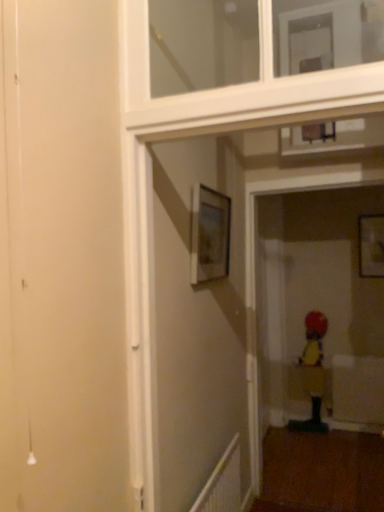
Describe the element at coordinates (209, 234) in the screenshot. I see `matte wooden picture frame at upper center, which ranks as the 1th picture frame in left-to-right order` at that location.

The image size is (384, 512). What are the coordinates of `matte wooden picture frame at upper right, placed as the 1th picture frame when sorted from right to left` in the screenshot? It's located at (371, 246).

In order to click on yellow fabric child at lower right in this screenshot , I will do `click(313, 372)`.

Describe the element at coordinates (222, 483) in the screenshot. The width and height of the screenshot is (384, 512). I see `white plastic radiator at lower right` at that location.

The image size is (384, 512). I want to click on white plastic radiator at lower right, so click(x=222, y=483).

Image resolution: width=384 pixels, height=512 pixels. In order to click on white glossy window frame at upper center in this screenshot , I will do `click(235, 89)`.

Image resolution: width=384 pixels, height=512 pixels. What are the coordinates of `matte wooden picture frame at upper center, which ranks as the 1th picture frame in left-to-right order` in the screenshot? It's located at (209, 234).

Consider the image. Which is less distant, (371, 258) or (237, 93)?

The point (237, 93) is closer to the camera.

Locate an element on the screen. This screenshot has height=512, width=384. picture frame on the right of white glossy window frame at upper center is located at coordinates (371, 246).

From a real-world perspective, who is located lower, matte wooden picture frame at upper right, the first picture frame from the back, or white glossy window frame at upper center?

From a 3D spatial view, matte wooden picture frame at upper right, the first picture frame from the back, is below.

Considering the sizes of matte wooden picture frame at upper right, the 2th picture frame in the left-to-right sequence, and matte wooden picture frame at upper center, which is the first picture frame in front-to-back order, in the image, is matte wooden picture frame at upper right, the 2th picture frame in the left-to-right sequence, taller or shorter than matte wooden picture frame at upper center, which is the first picture frame in front-to-back order,?

Clearly, matte wooden picture frame at upper right, the 2th picture frame in the left-to-right sequence, is taller compared to matte wooden picture frame at upper center, which is the first picture frame in front-to-back order.

Is point (362, 260) farther from viewer compared to point (217, 231)?

Yes.

From a real-world perspective, is matte wooden picture frame at upper right, the 2th picture frame in the left-to-right sequence, on matte wooden picture frame at upper center, which ranks as the 1th picture frame in left-to-right order?

No.

Would you say matte wooden picture frame at upper right, the 2th picture frame in the left-to-right sequence, contains matte wooden picture frame at upper center, the 2th picture frame when ordered from back to front?

Definitely not — matte wooden picture frame at upper center, the 2th picture frame when ordered from back to front, is not inside matte wooden picture frame at upper right, the 2th picture frame in the left-to-right sequence.

From a real-world perspective, which is physically above, matte wooden picture frame at upper center, which is the first picture frame in front-to-back order, or matte wooden picture frame at upper right, which is the 2th picture frame from front to back?

In real-world perspective, matte wooden picture frame at upper center, which is the first picture frame in front-to-back order, is above.

Is matte wooden picture frame at upper center, the 2th picture frame when ordered from back to front, with matte wooden picture frame at upper right, the 2th picture frame in the left-to-right sequence?

matte wooden picture frame at upper center, the 2th picture frame when ordered from back to front, and matte wooden picture frame at upper right, the 2th picture frame in the left-to-right sequence, are not in contact.

Considering the sizes of objects matte wooden picture frame at upper center, which ranks as the 1th picture frame in left-to-right order, and matte wooden picture frame at upper right, the first picture frame from the back, in the image provided, who is wider, matte wooden picture frame at upper center, which ranks as the 1th picture frame in left-to-right order, or matte wooden picture frame at upper right, the first picture frame from the back,?

matte wooden picture frame at upper center, which ranks as the 1th picture frame in left-to-right order, is wider.

Is matte wooden picture frame at upper center, which ranks as the 1th picture frame in left-to-right order, facing towards matte wooden picture frame at upper right, the first picture frame from the back?

No, matte wooden picture frame at upper center, which ranks as the 1th picture frame in left-to-right order, is not oriented towards matte wooden picture frame at upper right, the first picture frame from the back.

From the image's perspective, between yellow fabric child at lower right and matte wooden picture frame at upper center, the 2th picture frame when ordered from right to left, who is located below?

yellow fabric child at lower right is shown below in the image.

From a real-world perspective, relative to matte wooden picture frame at upper center, the 2th picture frame when ordered from back to front, is yellow fabric child at lower right vertically above or below?

yellow fabric child at lower right is situated lower than matte wooden picture frame at upper center, the 2th picture frame when ordered from back to front, in the real world.

Considering the positions of objects yellow fabric child at lower right and matte wooden picture frame at upper center, the 2th picture frame when ordered from back to front, in the image provided, who is behind, yellow fabric child at lower right or matte wooden picture frame at upper center, the 2th picture frame when ordered from back to front,?

Positioned behind is yellow fabric child at lower right.

In the scene shown: Which object is thinner, yellow fabric child at lower right or matte wooden picture frame at upper center, which ranks as the 1th picture frame in left-to-right order?

matte wooden picture frame at upper center, which ranks as the 1th picture frame in left-to-right order.

From the image's perspective, which one is positioned higher, yellow fabric child at lower right or matte wooden picture frame at upper right, the first picture frame from the back?

matte wooden picture frame at upper right, the first picture frame from the back, is shown above in the image.

Looking at this image, is yellow fabric child at lower right positioned before matte wooden picture frame at upper right, placed as the 1th picture frame when sorted from right to left?

No, yellow fabric child at lower right is further to the viewer.

Looking at this image, is yellow fabric child at lower right far from matte wooden picture frame at upper right, which is the 2th picture frame from front to back?

No.

From a real-world perspective, which object rests below the other?

In real-world perspective, yellow fabric child at lower right is lower.

Can you tell me how much yellow fabric child at lower right and white glossy window frame at upper center differ in facing direction?

yellow fabric child at lower right and white glossy window frame at upper center are facing 1.16 degrees away from each other.

Could you tell me if yellow fabric child at lower right is turned towards white glossy window frame at upper center?

Yes.

From the picture: Is there a large distance between yellow fabric child at lower right and white glossy window frame at upper center?

Yes.

From the image's perspective, which is below, yellow fabric child at lower right or white glossy window frame at upper center?

From the image's view, yellow fabric child at lower right is below.

Is matte wooden picture frame at upper center, which is the first picture frame in front-to-back order, bigger than white plastic radiator at lower right?

Incorrect, matte wooden picture frame at upper center, which is the first picture frame in front-to-back order, is not larger than white plastic radiator at lower right.

Is matte wooden picture frame at upper center, which is the first picture frame in front-to-back order, facing towards white plastic radiator at lower right?

No, matte wooden picture frame at upper center, which is the first picture frame in front-to-back order, is not oriented towards white plastic radiator at lower right.

Which object is thinner, matte wooden picture frame at upper center, the 2th picture frame when ordered from back to front, or white plastic radiator at lower right?

matte wooden picture frame at upper center, the 2th picture frame when ordered from back to front.

Image resolution: width=384 pixels, height=512 pixels. Identify the location of picture frame on the right of the white glossy window frame at upper center. (371, 246).

What are the coordinates of `picture frame that is below the matte wooden picture frame at upper center, the 2th picture frame when ordered from right to left (from the image's perspective)` in the screenshot? It's located at (371, 246).

From the image, which object appears to be farther from white glossy window frame at upper center, matte wooden picture frame at upper center, which is the first picture frame in front-to-back order, or matte wooden picture frame at upper right, placed as the 1th picture frame when sorted from right to left?

Among the two, matte wooden picture frame at upper right, placed as the 1th picture frame when sorted from right to left, is located further to white glossy window frame at upper center.

Considering their positions, is matte wooden picture frame at upper right, the first picture frame from the back, positioned closer to white plastic radiator at lower right than white glossy window frame at upper center?

Based on the image, white glossy window frame at upper center appears to be nearer to white plastic radiator at lower right.

When comparing their distances from matte wooden picture frame at upper center, the 2th picture frame when ordered from back to front, does matte wooden picture frame at upper right, which is the 2th picture frame from front to back, or white plastic radiator at lower right seem further?

matte wooden picture frame at upper right, which is the 2th picture frame from front to back.

Based on their spatial positions, is white plastic radiator at lower right or yellow fabric child at lower right further from matte wooden picture frame at upper right, the first picture frame from the back?

white plastic radiator at lower right is positioned further to the anchor matte wooden picture frame at upper right, the first picture frame from the back.

From the image, which object appears to be farther from yellow fabric child at lower right, matte wooden picture frame at upper center, the 2th picture frame when ordered from right to left, or white plastic radiator at lower right?

matte wooden picture frame at upper center, the 2th picture frame when ordered from right to left, is positioned further to the anchor yellow fabric child at lower right.

Based on their spatial positions, is white glossy window frame at upper center or matte wooden picture frame at upper center, which is the first picture frame in front-to-back order, closer to white plastic radiator at lower right?

Among the two, matte wooden picture frame at upper center, which is the first picture frame in front-to-back order, is located nearer to white plastic radiator at lower right.

Estimate the real-world distances between objects in this image. Which object is further from matte wooden picture frame at upper center, the 2th picture frame when ordered from right to left, white glossy window frame at upper center or yellow fabric child at lower right?

The object further to matte wooden picture frame at upper center, the 2th picture frame when ordered from right to left, is yellow fabric child at lower right.

Which object lies nearer to the anchor point matte wooden picture frame at upper right, the 2th picture frame in the left-to-right sequence, matte wooden picture frame at upper center, which ranks as the 1th picture frame in left-to-right order, or white plastic radiator at lower right?

matte wooden picture frame at upper center, which ranks as the 1th picture frame in left-to-right order.

Where is `radiator between white glossy window frame at upper center and yellow fabric child at lower right in the front-back direction`? This screenshot has width=384, height=512. radiator between white glossy window frame at upper center and yellow fabric child at lower right in the front-back direction is located at coordinates (222, 483).

This screenshot has width=384, height=512. Find the location of `picture frame between white plastic radiator at lower right and matte wooden picture frame at upper right, placed as the 1th picture frame when sorted from right to left, along the z-axis`. picture frame between white plastic radiator at lower right and matte wooden picture frame at upper right, placed as the 1th picture frame when sorted from right to left, along the z-axis is located at coordinates (209, 234).

Image resolution: width=384 pixels, height=512 pixels. I want to click on picture frame positioned between white glossy window frame at upper center and matte wooden picture frame at upper right, which is the 2th picture frame from front to back, from near to far, so click(x=209, y=234).

At what (x,y) coordinates should I click in order to perform the action: click on picture frame located between matte wooden picture frame at upper center, which is the first picture frame in front-to-back order, and yellow fabric child at lower right in the depth direction. Please return your answer as a coordinate pair (x, y). Looking at the image, I should click on (371, 246).